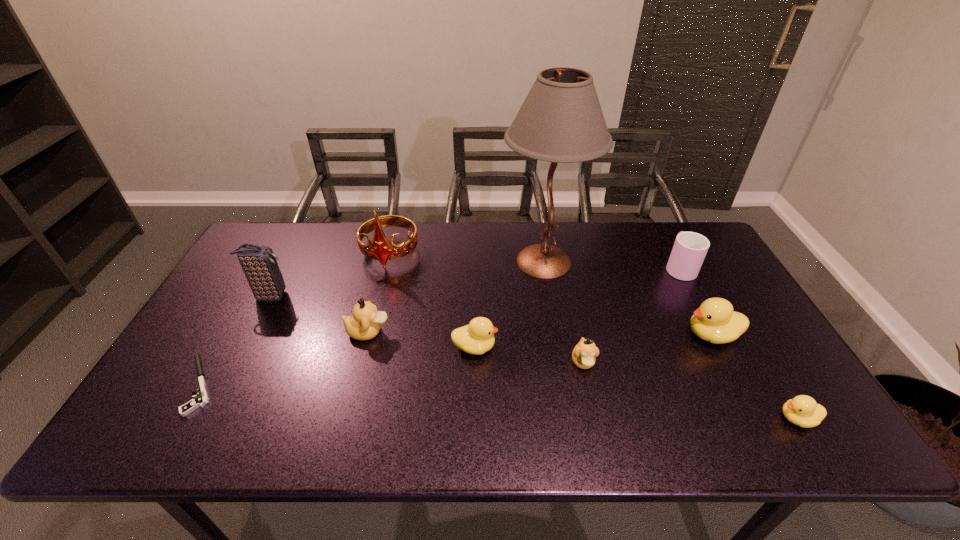
This screenshot has height=540, width=960. Identify the location of vacant space located with the zip open on the third tallest object. (350, 296).

The width and height of the screenshot is (960, 540). What are the coordinates of `free region located 0.390m on the beak of the biggest yellow duckling` in the screenshot? It's located at (540, 335).

Locate an element on the screen. free spot located on the beak of the biggest yellow duckling is located at coordinates (558, 335).

Image resolution: width=960 pixels, height=540 pixels. Find the location of `vacant space located on the beak of the biggest yellow duckling`. vacant space located on the beak of the biggest yellow duckling is located at coordinates (558, 335).

Identify the location of blank space located with the handle on the side of the cup. (666, 243).

The width and height of the screenshot is (960, 540). I want to click on vacant space located with the handle on the side of the cup, so click(663, 238).

You are a GUI agent. You are given a task and a screenshot of the screen. Output one action in this format:
    pyautogui.click(x=<x>, y=<y>)
    Task: Click on the free spot located with the handle on the side of the cup
    The image size is (960, 540).
    Given the screenshot: What is the action you would take?
    pyautogui.click(x=665, y=241)

Locate an element on the screen. The image size is (960, 540). vacant space located 0.160m on the face of the bigger tan duckling is located at coordinates (449, 332).

At what (x,y) coordinates should I click in order to perform the action: click on vacant space situated on the beak of the second smallest yellow duckling. Please return your answer as a coordinate pair (x, y). The width and height of the screenshot is (960, 540). Looking at the image, I should click on (601, 347).

In order to click on vacant region located 0.060m on the face of the third duckling from right to left in this screenshot , I will do `click(591, 398)`.